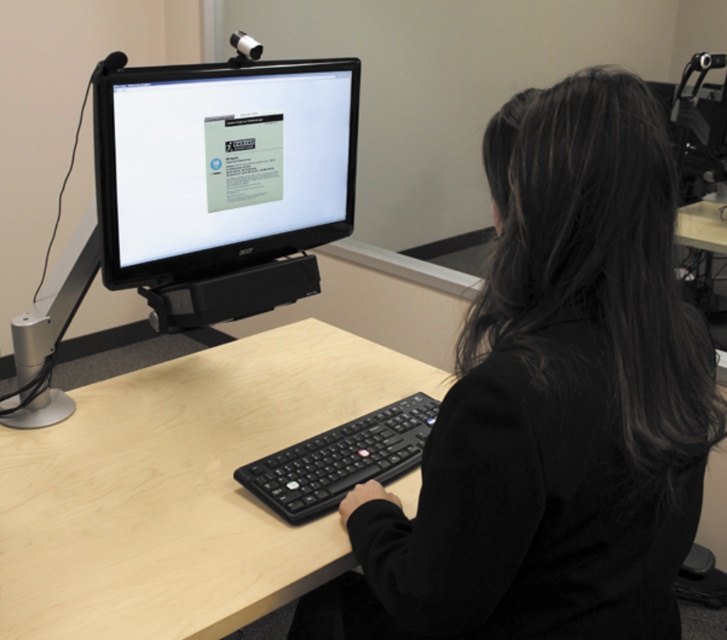
Question: Does black matte keyboard at center have a larger size compared to light wood/black keyboard at center?

Choices:
 (A) yes
 (B) no

Answer: (B)

Question: Is black matte keyboard at center below black plastic keyboard at center?

Choices:
 (A) yes
 (B) no

Answer: (B)

Question: Which object is closer to the camera taking this photo?

Choices:
 (A) matte black monitor at center
 (B) light wood/black keyboard at center

Answer: (B)

Question: Which point is farther to the camera?

Choices:
 (A) matte black monitor at center
 (B) black plastic keyboard at center
 (C) black matte keyboard at center
 (D) light wood/black keyboard at center

Answer: (A)

Question: From the image, what is the correct spatial relationship of black matte keyboard at center in relation to light wood/black keyboard at center?

Choices:
 (A) above
 (B) below

Answer: (A)

Question: Among these objects, which one is nearest to the camera?

Choices:
 (A) light wood/black keyboard at center
 (B) black plastic keyboard at center
 (C) black matte keyboard at center

Answer: (C)